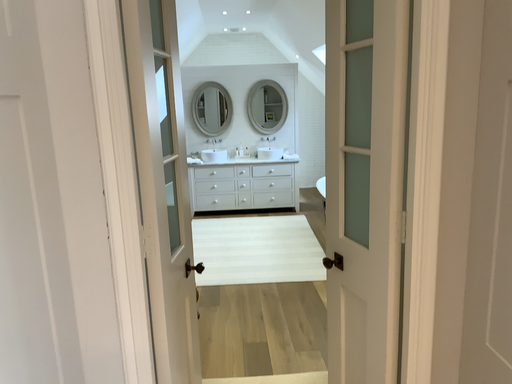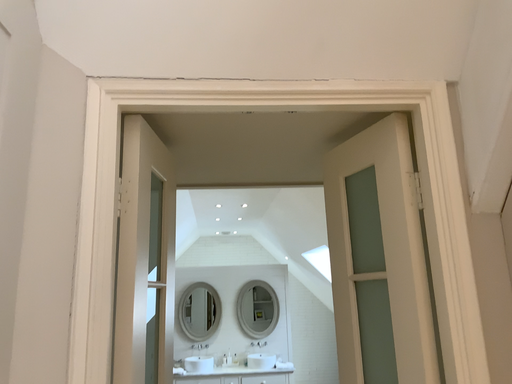
Question: How did the camera likely rotate when shooting the video?

Choices:
 (A) rotated upward
 (B) rotated downward

Answer: (A)